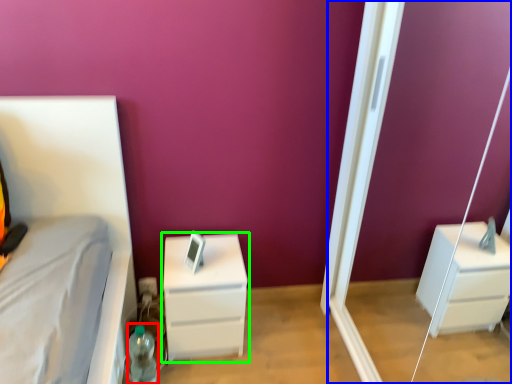
Question: Which is nearer to the bottle (highlighted by a red box)? screen door (highlighted by a blue box) or chest of drawers (highlighted by a green box).

Choices:
 (A) screen door
 (B) chest of drawers

Answer: (B)